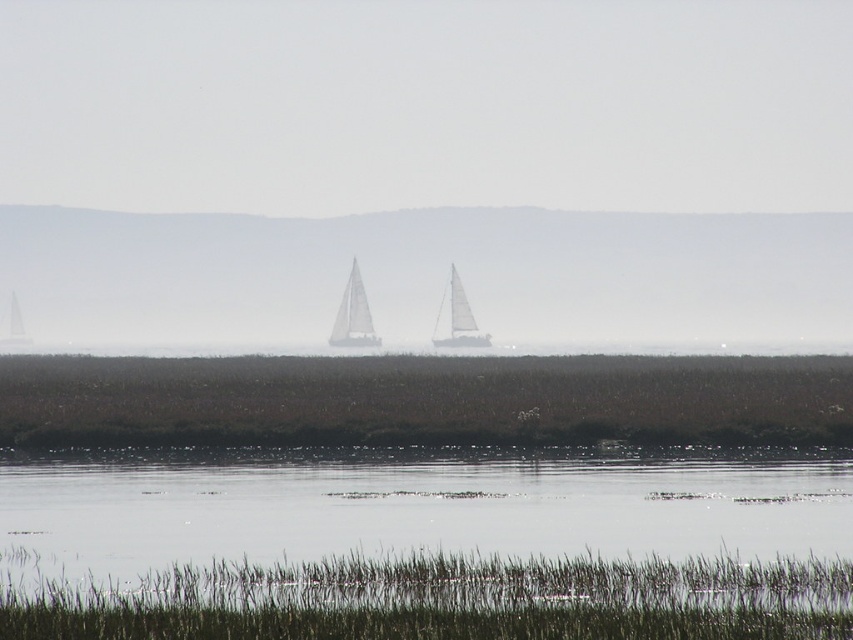
Question: Can you confirm if clear water at lower center is positioned below white sailboat at left?

Choices:
 (A) no
 (B) yes

Answer: (B)

Question: Can you confirm if foggy white sailboats at center is bigger than white matte sailboat at center?

Choices:
 (A) yes
 (B) no

Answer: (A)

Question: Considering the real-world distances, which object is farthest from the clear water at lower center?

Choices:
 (A) foggy white sailboats at center
 (B) white matte sailboat at center
 (C) white sailboat at center
 (D) green grass at lower center

Answer: (A)

Question: From the image, what is the correct spatial relationship of clear water at lower center in relation to white sailboat at left?

Choices:
 (A) right
 (B) left

Answer: (A)

Question: Estimate the real-world distances between objects in this image. Which object is farther from the white matte sailboat at center?

Choices:
 (A) white sailboat at center
 (B) clear water at lower center

Answer: (B)

Question: Which of the following is the farthest from the observer?

Choices:
 (A) clear water at lower center
 (B) green grass at lower center

Answer: (A)